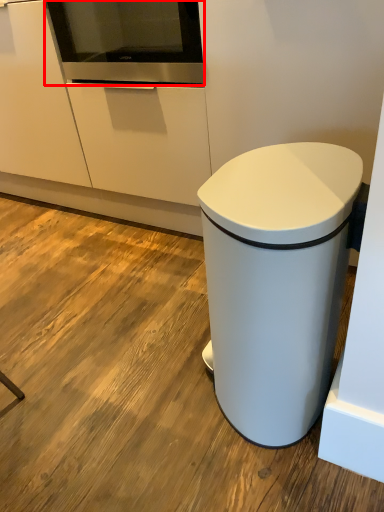
Question: From the image's perspective, considering the relative positions of home appliance (annotated by the red box) and waste container in the image provided, where is home appliance (annotated by the red box) located with respect to the staircase?

Choices:
 (A) below
 (B) above

Answer: (B)